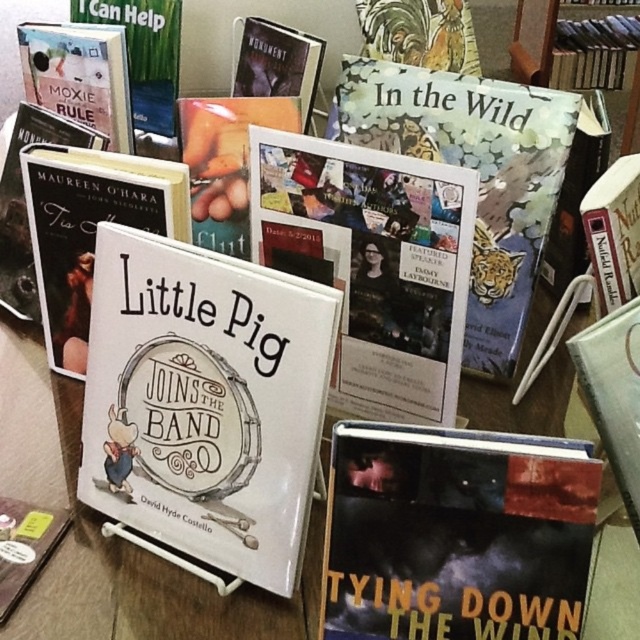
Question: Can you confirm if white paper flyer at center is thinner than hardcover book at upper center?

Choices:
 (A) yes
 (B) no

Answer: (A)

Question: Estimate the real-world distances between objects in this image. Which object is closer to the hardcover book at upper center?

Choices:
 (A) white textured bookshelf at upper right
 (B) dark matte book at lower right
 (C) hardcover book at left

Answer: (B)

Question: Can you confirm if dark matte book at lower right is thinner than hardcover book at upper left?

Choices:
 (A) yes
 (B) no

Answer: (B)

Question: Which object is farther from the camera taking this photo?

Choices:
 (A) hardcover book at right
 (B) hardcover book at upper right
 (C) white paper flyer at center
 (D) white paper book at center

Answer: (B)

Question: Which point is farther to the camera?

Choices:
 (A) (54, 138)
 (B) (182, 166)

Answer: (A)

Question: Does hardcover book at upper left have a larger size compared to hardcover book at right?

Choices:
 (A) yes
 (B) no

Answer: (A)